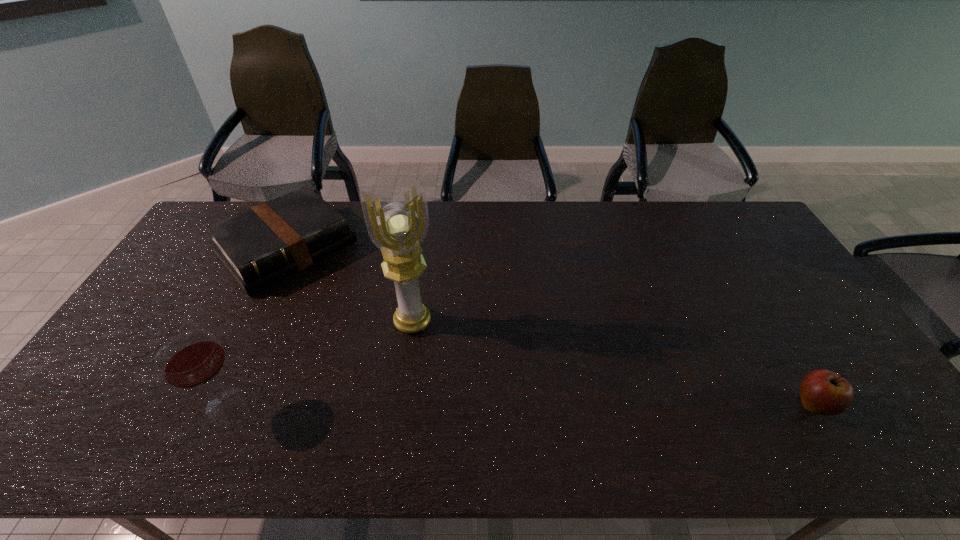
I want to click on the second tallest object, so click(x=191, y=359).

Where is `apple`? This screenshot has height=540, width=960. apple is located at coordinates (823, 392).

Where is `the rightmost object`? This screenshot has width=960, height=540. the rightmost object is located at coordinates (823, 392).

What are the coordinates of `the tallest object` in the screenshot? It's located at (398, 227).

You are a GUI agent. You are given a task and a screenshot of the screen. Output one action in this format:
    pyautogui.click(x=<x>, y=<y>)
    Task: Click on the third nearest object
    
    Given the screenshot: What is the action you would take?
    pyautogui.click(x=398, y=227)

Identify the location of the farthest object. The width and height of the screenshot is (960, 540). (260, 246).

Where is `hardback book`? This screenshot has width=960, height=540. hardback book is located at coordinates pos(260,246).

Find the location of a particular element. This screenshot has width=960, height=540. vacant region located on the right of the wineglass is located at coordinates (344, 404).

Find the location of a particular element. Image resolution: width=960 pixels, height=540 pixels. vacant space located on the back of the rightmost object is located at coordinates (x=775, y=343).

The height and width of the screenshot is (540, 960). Identify the location of free spot located 0.080m on the front-facing side of the tallest object. (427, 359).